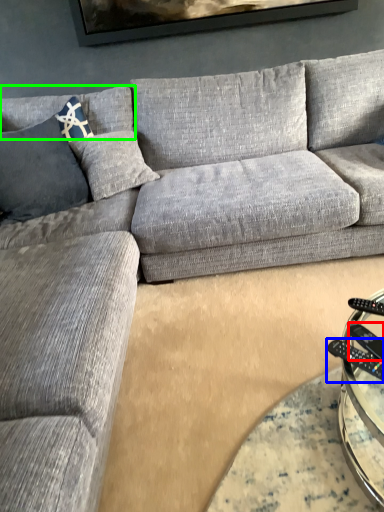
Question: Considering the real-world distances, which object is farthest from remote (highlighted by a red box)? control (highlighted by a blue box) or pillow (highlighted by a green box)?

Choices:
 (A) control
 (B) pillow

Answer: (B)